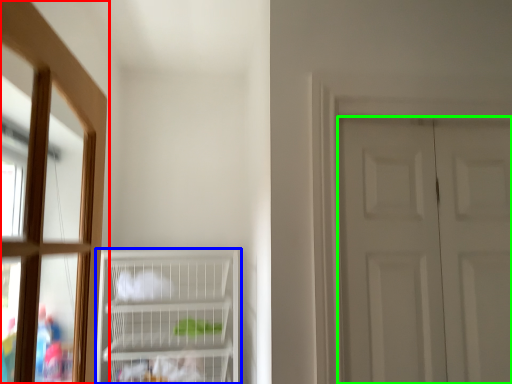
Question: Based on their relative distances, which object is nearer to window (highlighted by a red box)? Choose from cupboard (highlighted by a blue box) and door (highlighted by a green box).

Choices:
 (A) cupboard
 (B) door

Answer: (A)